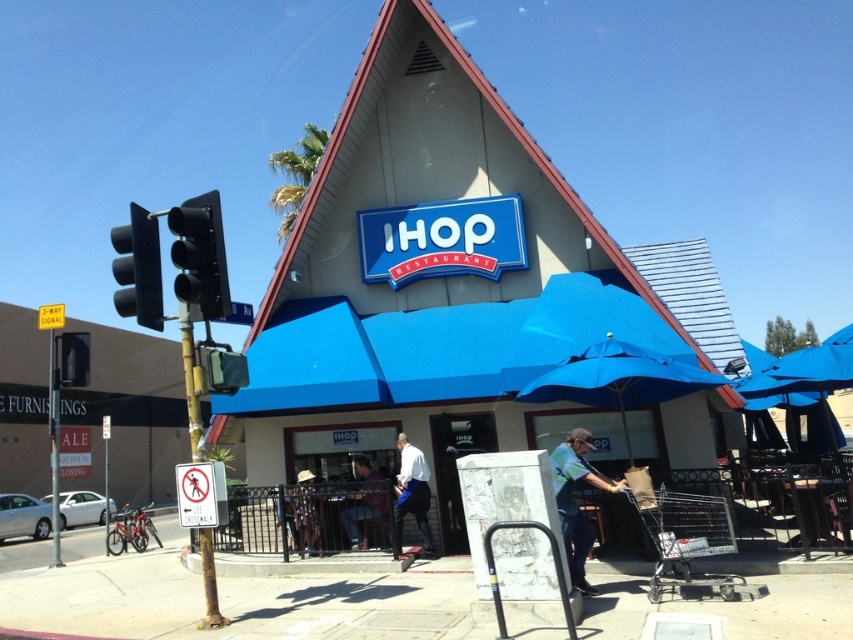
Question: Can you confirm if blue fabric umbrella at center is positioned above camouflage-patterned shirt at center?

Choices:
 (A) no
 (B) yes

Answer: (B)

Question: Which of the following is the closest to the observer?

Choices:
 (A) (601, 253)
 (B) (303, 532)
 (C) (408, 454)

Answer: (C)

Question: Is blue fabric umbrella at center thinner than white cotton shirt at center?

Choices:
 (A) no
 (B) yes

Answer: (A)

Question: Which object appears closest to the camera in this image?

Choices:
 (A) green-cotton shirt at lower right
 (B) blue awning at center
 (C) camouflage-patterned shirt at center

Answer: (A)

Question: Is blue fabric umbrella at center further to the viewer compared to camouflage-patterned shirt at center?

Choices:
 (A) yes
 (B) no

Answer: (B)

Question: Among these points, which one is nearest to the camera?

Choices:
 (A) (416, 458)
 (B) (364, 476)

Answer: (A)